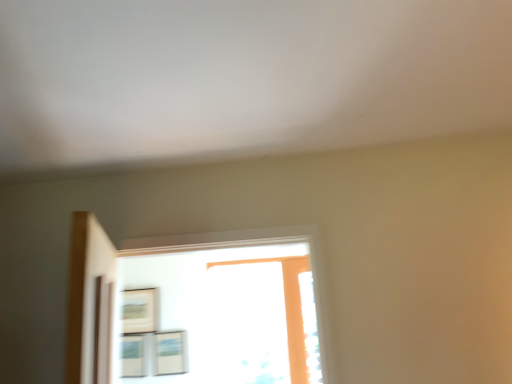
Locate an element on the screen. This screenshot has height=384, width=512. matte wooden picture frame at center, which ranks as the first picture frame in right-to-left order is located at coordinates (170, 352).

The height and width of the screenshot is (384, 512). What do you see at coordinates (170, 352) in the screenshot? I see `matte wooden picture frame at center, which ranks as the first picture frame in right-to-left order` at bounding box center [170, 352].

Locate an element on the screen. matte black picture frame at upper left, arranged as the third picture frame when viewed from the right is located at coordinates (139, 310).

Where is `matte wooden picture frame at center, the third picture frame from the left`? The height and width of the screenshot is (384, 512). matte wooden picture frame at center, the third picture frame from the left is located at coordinates (170, 352).

Could you tell me if matte wooden picture frame at center, the third picture frame from the left, is facing matte white picture frame at lower left, marked as the second picture frame in a left-to-right arrangement?

No, matte wooden picture frame at center, the third picture frame from the left, is not turned towards matte white picture frame at lower left, marked as the second picture frame in a left-to-right arrangement.

Is matte white picture frame at lower left, arranged as the 2th picture frame when viewed from the right, surrounded by matte wooden picture frame at center, which ranks as the first picture frame in right-to-left order?

No, matte white picture frame at lower left, arranged as the 2th picture frame when viewed from the right, is located outside of matte wooden picture frame at center, which ranks as the first picture frame in right-to-left order.

Which of these two, matte wooden picture frame at center, which ranks as the first picture frame in right-to-left order, or matte white picture frame at lower left, marked as the second picture frame in a left-to-right arrangement, is thinner?

matte white picture frame at lower left, marked as the second picture frame in a left-to-right arrangement.

Is matte black picture frame at upper left, the first picture frame when ordered from left to right, closer to the viewer compared to matte white picture frame at lower left, marked as the second picture frame in a left-to-right arrangement?

That is False.

Does point (143, 307) appear closer or farther from the camera than point (135, 344)?

Point (143, 307).

Would you say matte black picture frame at upper left, the first picture frame when ordered from left to right, is a long distance from matte white picture frame at lower left, arranged as the 2th picture frame when viewed from the right?

No, matte black picture frame at upper left, the first picture frame when ordered from left to right, is not far from matte white picture frame at lower left, arranged as the 2th picture frame when viewed from the right.

Is matte black picture frame at upper left, the first picture frame when ordered from left to right, inside or outside of matte white picture frame at lower left, marked as the second picture frame in a left-to-right arrangement?

The correct answer is: outside.

What's the angular difference between matte white picture frame at lower left, arranged as the 2th picture frame when viewed from the right, and matte black picture frame at upper left, the first picture frame when ordered from left to right,'s facing directions?

matte white picture frame at lower left, arranged as the 2th picture frame when viewed from the right, and matte black picture frame at upper left, the first picture frame when ordered from left to right, are facing 0.129 degrees away from each other.

Would you say matte white picture frame at lower left, arranged as the 2th picture frame when viewed from the right, contains matte black picture frame at upper left, the first picture frame when ordered from left to right?

No.

Find the location of a particular element. Image resolution: width=512 pixels, height=384 pixels. the 2nd picture frame below the matte black picture frame at upper left, the first picture frame when ordered from left to right (from a real-world perspective) is located at coordinates (134, 355).

Considering the points (130, 348) and (152, 321), which point is behind, point (130, 348) or point (152, 321)?

Point (152, 321)

Can you confirm if matte white picture frame at lower left, marked as the second picture frame in a left-to-right arrangement, is positioned to the left of matte wooden picture frame at center, the third picture frame from the left?

Indeed, matte white picture frame at lower left, marked as the second picture frame in a left-to-right arrangement, is positioned on the left side of matte wooden picture frame at center, the third picture frame from the left.

Does matte white picture frame at lower left, marked as the second picture frame in a left-to-right arrangement, turn towards matte wooden picture frame at center, which ranks as the first picture frame in right-to-left order?

No, matte white picture frame at lower left, marked as the second picture frame in a left-to-right arrangement, is not aimed at matte wooden picture frame at center, which ranks as the first picture frame in right-to-left order.

Which object is thinner, matte white picture frame at lower left, arranged as the 2th picture frame when viewed from the right, or matte wooden picture frame at center, the third picture frame from the left?

matte white picture frame at lower left, arranged as the 2th picture frame when viewed from the right.

Considering the sizes of matte black picture frame at upper left, arranged as the third picture frame when viewed from the right, and matte wooden picture frame at center, which ranks as the first picture frame in right-to-left order, in the image, is matte black picture frame at upper left, arranged as the third picture frame when viewed from the right, wider or thinner than matte wooden picture frame at center, which ranks as the first picture frame in right-to-left order,?

In the image, matte black picture frame at upper left, arranged as the third picture frame when viewed from the right, appears to be wider than matte wooden picture frame at center, which ranks as the first picture frame in right-to-left order.

Between matte black picture frame at upper left, the first picture frame when ordered from left to right, and matte wooden picture frame at center, which ranks as the first picture frame in right-to-left order, which one has more height?

matte black picture frame at upper left, the first picture frame when ordered from left to right.

Can you confirm if matte black picture frame at upper left, the first picture frame when ordered from left to right, is bigger than matte wooden picture frame at center, which ranks as the first picture frame in right-to-left order?

Yes.

How many degrees apart are the facing directions of matte black picture frame at upper left, arranged as the third picture frame when viewed from the right, and matte wooden picture frame at center, the third picture frame from the left?

The angle between the facing direction of matte black picture frame at upper left, arranged as the third picture frame when viewed from the right, and the facing direction of matte wooden picture frame at center, the third picture frame from the left, is 0.129 degrees.

Considering the relative sizes of matte wooden picture frame at center, the third picture frame from the left, and matte black picture frame at upper left, the first picture frame when ordered from left to right, in the image provided, is matte wooden picture frame at center, the third picture frame from the left, bigger than matte black picture frame at upper left, the first picture frame when ordered from left to right,?

No, matte wooden picture frame at center, the third picture frame from the left, is not bigger than matte black picture frame at upper left, the first picture frame when ordered from left to right.

Can you confirm if matte wooden picture frame at center, the third picture frame from the left, is positioned to the right of matte black picture frame at upper left, the first picture frame when ordered from left to right?

Yes.

Is matte wooden picture frame at center, the third picture frame from the left, not inside matte black picture frame at upper left, arranged as the third picture frame when viewed from the right?

matte wooden picture frame at center, the third picture frame from the left, lies outside matte black picture frame at upper left, arranged as the third picture frame when viewed from the right,'s area.

From the image's perspective, is matte wooden picture frame at center, the third picture frame from the left, below matte black picture frame at upper left, arranged as the third picture frame when viewed from the right?

Yes.

From a real-world perspective, which picture frame is the 1st one above the matte white picture frame at lower left, marked as the second picture frame in a left-to-right arrangement? Please provide its 2D coordinates.

[(170, 352)]

Where is `the 2nd picture frame below the matte black picture frame at upper left, arranged as the third picture frame when viewed from the right (from the image's perspective)`? the 2nd picture frame below the matte black picture frame at upper left, arranged as the third picture frame when viewed from the right (from the image's perspective) is located at coordinates (134, 355).

Estimate the real-world distances between objects in this image. Which object is further from matte white picture frame at lower left, arranged as the 2th picture frame when viewed from the right, matte wooden picture frame at center, the third picture frame from the left, or matte black picture frame at upper left, the first picture frame when ordered from left to right?

matte black picture frame at upper left, the first picture frame when ordered from left to right.

From the image, which object appears to be nearer to matte wooden picture frame at center, which ranks as the first picture frame in right-to-left order, matte black picture frame at upper left, the first picture frame when ordered from left to right, or matte white picture frame at lower left, marked as the second picture frame in a left-to-right arrangement?

Based on the image, matte white picture frame at lower left, marked as the second picture frame in a left-to-right arrangement, appears to be nearer to matte wooden picture frame at center, which ranks as the first picture frame in right-to-left order.

Consider the image. Estimate the real-world distances between objects in this image. Which object is further from matte wooden picture frame at center, the third picture frame from the left, matte white picture frame at lower left, marked as the second picture frame in a left-to-right arrangement, or matte black picture frame at upper left, the first picture frame when ordered from left to right?

matte black picture frame at upper left, the first picture frame when ordered from left to right, is positioned further to the anchor matte wooden picture frame at center, the third picture frame from the left.

Considering their positions, is matte black picture frame at upper left, arranged as the third picture frame when viewed from the right, positioned closer to matte white picture frame at lower left, arranged as the 2th picture frame when viewed from the right, than matte wooden picture frame at center, the third picture frame from the left?

Among the two, matte wooden picture frame at center, the third picture frame from the left, is located nearer to matte white picture frame at lower left, arranged as the 2th picture frame when viewed from the right.

From the image, which object appears to be nearer to matte black picture frame at upper left, arranged as the third picture frame when viewed from the right, matte white picture frame at lower left, arranged as the 2th picture frame when viewed from the right, or matte wooden picture frame at center, the third picture frame from the left?

Among the two, matte white picture frame at lower left, arranged as the 2th picture frame when viewed from the right, is located nearer to matte black picture frame at upper left, arranged as the third picture frame when viewed from the right.

Looking at the image, which one is located closer to matte black picture frame at upper left, the first picture frame when ordered from left to right, matte wooden picture frame at center, the third picture frame from the left, or matte white picture frame at lower left, marked as the second picture frame in a left-to-right arrangement?

matte white picture frame at lower left, marked as the second picture frame in a left-to-right arrangement.

Where is `picture frame between matte black picture frame at upper left, the first picture frame when ordered from left to right, and matte wooden picture frame at center, the third picture frame from the left`? The width and height of the screenshot is (512, 384). picture frame between matte black picture frame at upper left, the first picture frame when ordered from left to right, and matte wooden picture frame at center, the third picture frame from the left is located at coordinates (134, 355).